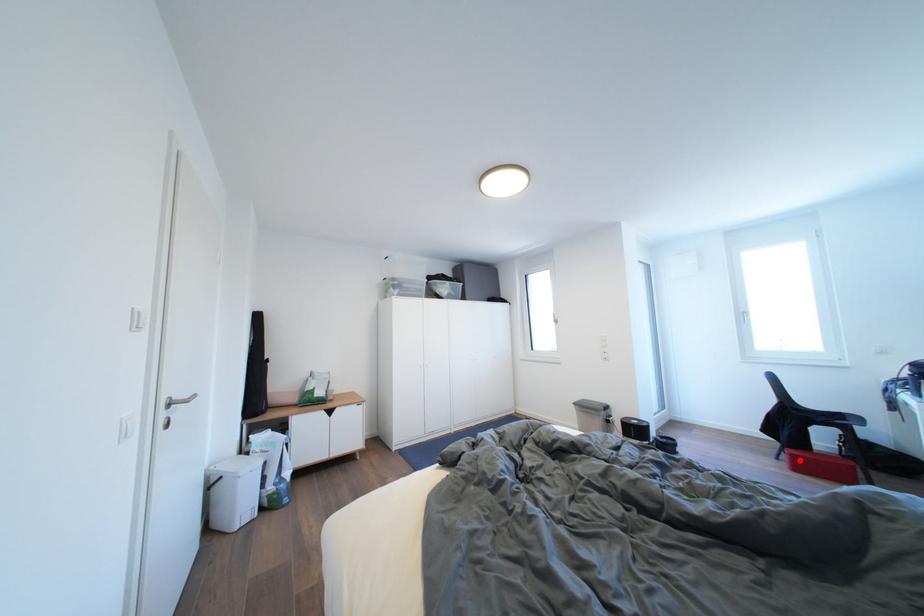
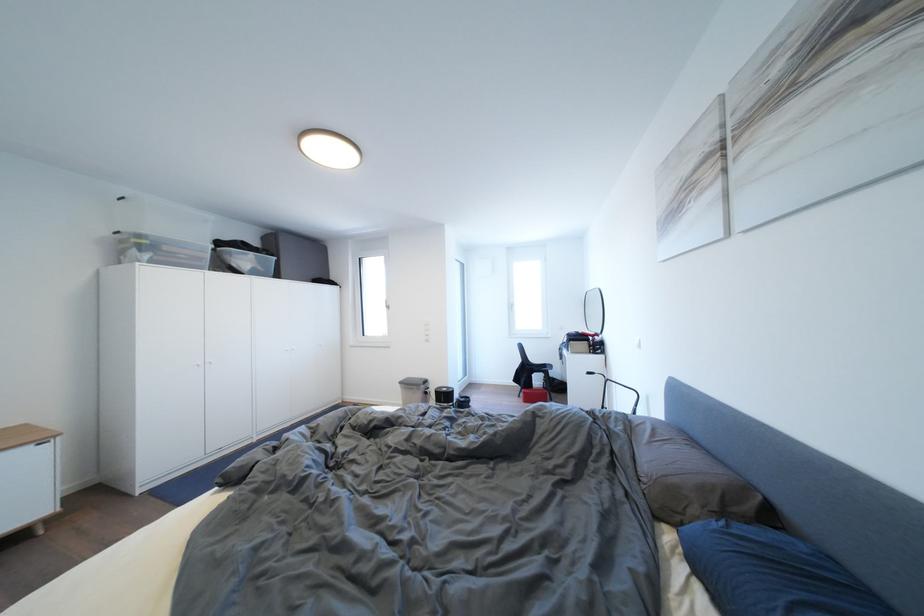
Question: I am providing you with two images of the same scene from different viewpoints. Image1 has a red point marked. In image2, the corresponding 3D location appears at what relative position? Reply with the corresponding letter.

Choices:
 (A) Closer
 (B) Farther

Answer: (A)